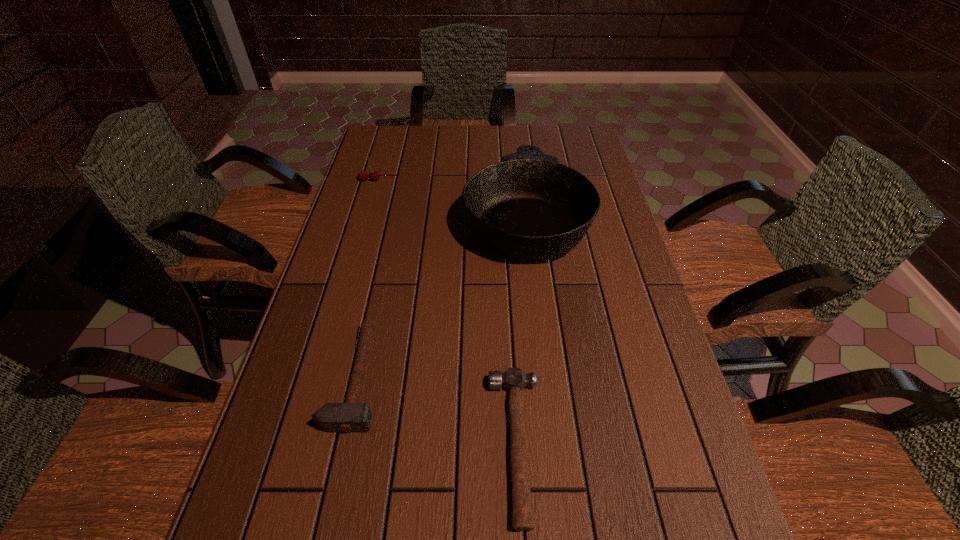
This screenshot has width=960, height=540. I want to click on vacant space at the right edge of the desktop, so [x=681, y=512].

In the image, there is a desktop. Identify the location of vacant space at the far left corner. This screenshot has width=960, height=540. (386, 155).

This screenshot has width=960, height=540. I want to click on empty space between the second tallest object and the shortest object, so click(444, 313).

Identify the location of empty space between the second shortest object and the shorter hammer. The image size is (960, 540). (436, 411).

You are a GUI agent. You are given a task and a screenshot of the screen. Output one action in this format:
    pyautogui.click(x=<x>, y=<y>)
    Task: Click on the vacant space that is in between the frying pan and the left hammer
    The height and width of the screenshot is (540, 960).
    Given the screenshot: What is the action you would take?
    pyautogui.click(x=441, y=296)

Find the location of `free space that is in between the leftmost object and the shorter hammer`. free space that is in between the leftmost object and the shorter hammer is located at coordinates (444, 313).

Where is `blank region between the right hammer and the tallest object`? This screenshot has width=960, height=540. blank region between the right hammer and the tallest object is located at coordinates (521, 330).

I want to click on free spot between the cherry and the shorter hammer, so click(x=444, y=313).

Locate an element on the screen. The height and width of the screenshot is (540, 960). empty space that is in between the second tallest object and the frying pan is located at coordinates (447, 198).

Find the location of a particular element. The width and height of the screenshot is (960, 540). vacant space in between the leftmost object and the taller hammer is located at coordinates (363, 279).